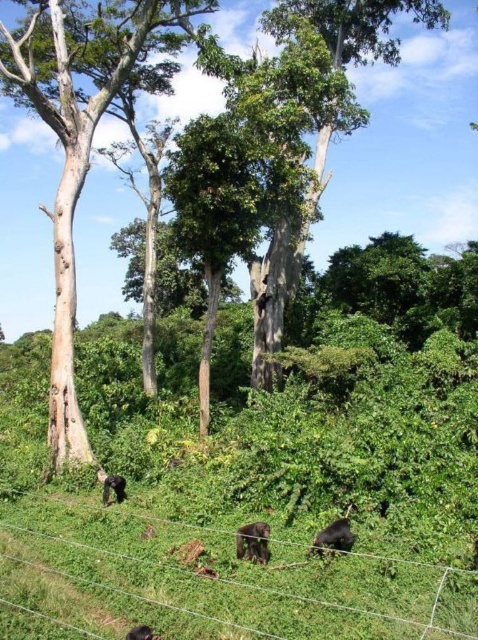
Between wire mesh at lower center and black fur monkey at lower center, which one has less height?

black fur monkey at lower center

From the picture: Can you confirm if wire mesh at lower center is thinner than black fur monkey at lower center?

No.

Find the location of a particular element. This screenshot has height=640, width=478. wire mesh at lower center is located at coordinates (206, 580).

Which is above, smooth light brown tree trunk at left or dark brown fur chimpanzee at lower center?

smooth light brown tree trunk at left is higher up.

Does smooth light brown tree trunk at left appear on the left side of dark brown fur chimpanzee at lower center?

Yes, smooth light brown tree trunk at left is to the left of dark brown fur chimpanzee at lower center.

Does point (49, 116) come in front of point (115, 493)?

That is False.

What are the coordinates of `smooth light brown tree trunk at left` in the screenshot? It's located at (79, 136).

Who is shorter, dark brown fur gorilla at lower center or dark brown fur at lower center?

dark brown fur at lower center is shorter.

Which is more to the left, dark brown fur gorilla at lower center or dark brown fur at lower center?

dark brown fur gorilla at lower center

Where is `dark brown fur gorilla at lower center`? Image resolution: width=478 pixels, height=640 pixels. dark brown fur gorilla at lower center is located at coordinates (252, 541).